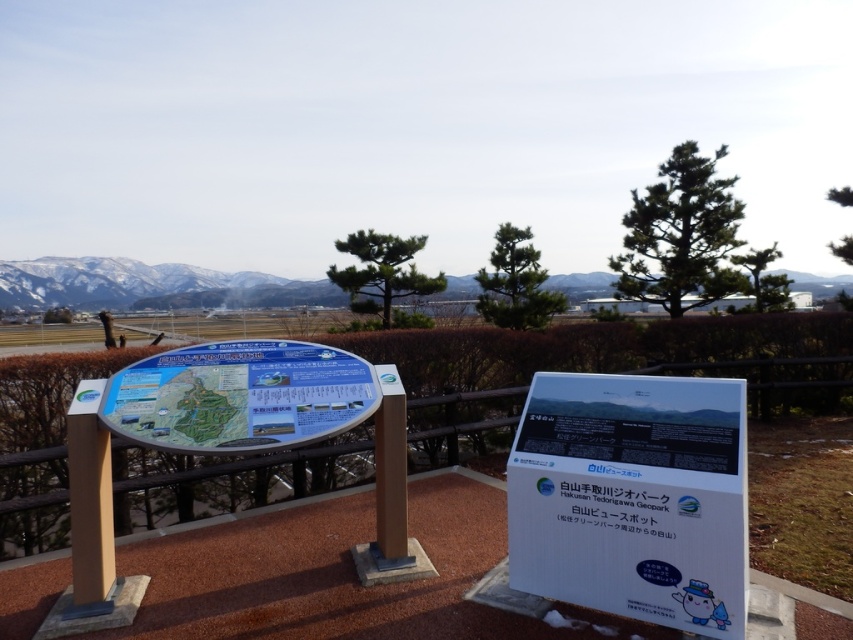
The width and height of the screenshot is (853, 640). What do you see at coordinates (239, 396) in the screenshot?
I see `blue plastic map at center` at bounding box center [239, 396].

Which is behind, point (209, 449) or point (94, 266)?

Positioned behind is point (94, 266).

Is point (262, 384) more distant than point (456, 285)?

That is False.

Locate an element on the screen. blue plastic map at center is located at coordinates (239, 396).

What do you see at coordinates (631, 497) in the screenshot?
I see `white plastic sign at center` at bounding box center [631, 497].

Describe the element at coordinates (631, 497) in the screenshot. The height and width of the screenshot is (640, 853). I see `white plastic sign at center` at that location.

In order to click on white plastic sign at center in this screenshot , I will do `click(631, 497)`.

Does white plastic sign at center have a lesser width compared to snowy white mountain at upper center?

Yes.

Between white plastic sign at center and snowy white mountain at upper center, which one has more height?

Standing taller between the two is snowy white mountain at upper center.

At what (x,y) coordinates should I click in order to perform the action: click on white plastic sign at center. Please return your answer as a coordinate pair (x, y). The width and height of the screenshot is (853, 640). Looking at the image, I should click on (631, 497).

Locate an element on the screen. This screenshot has height=640, width=853. white plastic sign at center is located at coordinates (631, 497).